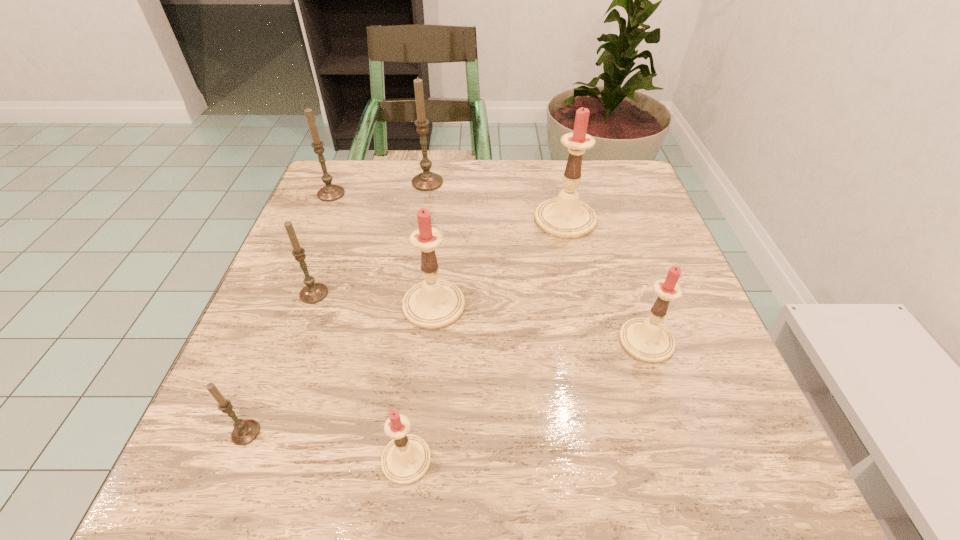
This screenshot has height=540, width=960. Identify the location of vacant space located 0.150m on the front of the third smallest gray candle. (311, 241).

The image size is (960, 540). In order to click on vacant space positioned 0.090m on the right of the third smallest red candle in this screenshot , I will do `click(512, 305)`.

Locate an element on the screen. blank space located 0.110m on the front of the third farthest gray candle is located at coordinates (293, 351).

You are a GUI agent. You are given a task and a screenshot of the screen. Output one action in this format:
    pyautogui.click(x=<x>, y=<y>)
    Task: Click on the free region located 0.080m on the left of the third biggest red candle
    
    Given the screenshot: What is the action you would take?
    pyautogui.click(x=575, y=341)

Find the location of a particular element. vacant region located 0.300m on the right of the smallest gray candle is located at coordinates coord(457,433).

Locate an element on the screen. The image size is (960, 540). vacant space located on the right of the smallest red candle is located at coordinates (535, 460).

The width and height of the screenshot is (960, 540). What are the coordinates of `object present at the far left corner` in the screenshot? It's located at (330, 192).

Find the location of a particular element. Image resolution: width=960 pixels, height=540 pixels. object that is positioned at the near left corner is located at coordinates [245, 431].

This screenshot has width=960, height=540. I want to click on object located in the far right corner section of the desktop, so click(566, 217).

In the image, there is a desktop. Where is `vacant space at the far edge`? The height and width of the screenshot is (540, 960). vacant space at the far edge is located at coordinates click(508, 164).